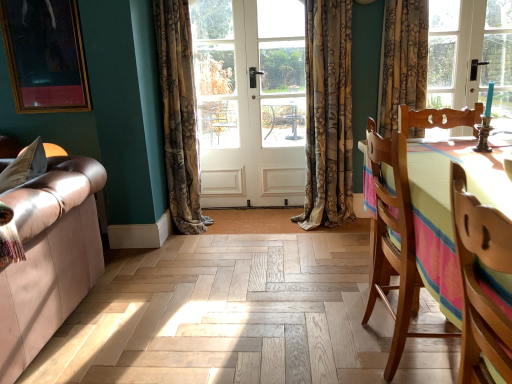
Question: Which is correct: wooden chair at right, placed as the first chair when sorted from front to back, is inside wooden chair at right, the first chair positioned from the back, or outside of it?

Choices:
 (A) outside
 (B) inside

Answer: (A)

Question: Relative to wooden chair at right, which is counted as the second chair, starting from the front, is wooden chair at right, placed as the first chair when sorted from front to back, in front or behind?

Choices:
 (A) behind
 (B) front

Answer: (B)

Question: Estimate the real-world distances between objects in this image. Which object is closer to the gold-framed portrait at upper left?

Choices:
 (A) white wood door at center
 (B) wooden chair at right, placed as the first chair when sorted from front to back
 (C) white wooden screen door at center
 (D) floral fabric curtain at center, acting as the second curtain starting from the left
 (E) floral fabric curtain at center, the 1th curtain in the left-to-right sequence

Answer: (E)

Question: Estimate the real-world distances between objects in this image. Which object is farther from the wooden chair at right, the second chair viewed from the back?

Choices:
 (A) wooden chair at right, the first chair positioned from the back
 (B) gold-framed portrait at upper left
 (C) white wooden screen door at center
 (D) floral fabric curtain at center, the 1th curtain in the left-to-right sequence
 (E) white wood door at center

Answer: (B)